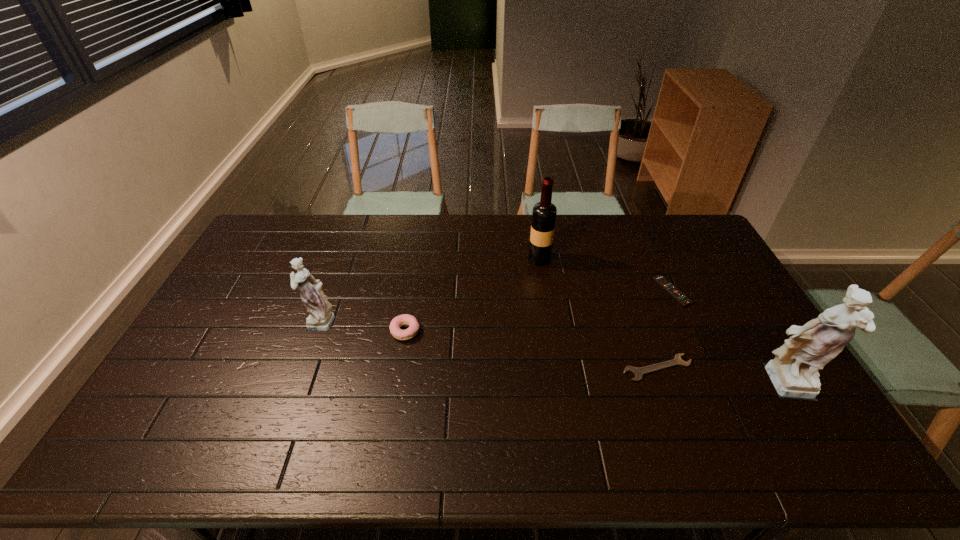
In the image, there is a desktop. Identify the location of vacant space at the far edge. The height and width of the screenshot is (540, 960). (662, 240).

Locate an element on the screen. The width and height of the screenshot is (960, 540). free space at the near edge is located at coordinates (217, 396).

In order to click on vacant area at the left edge in this screenshot , I will do `click(210, 357)`.

I want to click on vacant space at the near right corner of the desktop, so click(793, 417).

Locate an element on the screen. The image size is (960, 540). free space between the second farthest object and the doughnut is located at coordinates (539, 312).

At what (x,y) coordinates should I click in order to perform the action: click on free spot between the farthest object and the third shortest object. Please return your answer as a coordinate pair (x, y). This screenshot has width=960, height=540. Looking at the image, I should click on (472, 295).

Identify the location of free spot between the wine bottle and the doughnut. The image size is (960, 540). (472, 295).

The image size is (960, 540). Find the location of `vacant space that's between the wine bottle and the fourth shortest object`. vacant space that's between the wine bottle and the fourth shortest object is located at coordinates (429, 290).

Identify the location of free space between the remote control and the fifth shortest object. (606, 275).

At what (x,y) coordinates should I click in order to perform the action: click on free point between the taller figurine and the wrench. Please return your answer as a coordinate pair (x, y). Looking at the image, I should click on (722, 377).